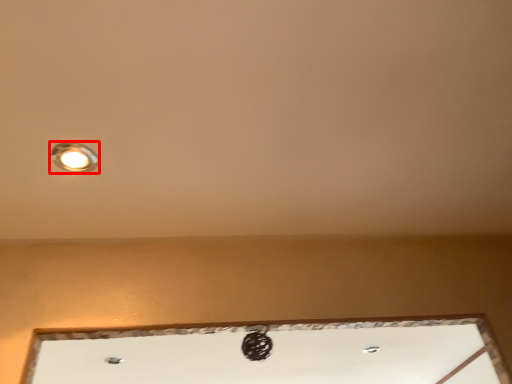
Question: From the image's perspective, where is lamp (annotated by the red box) located in relation to window in the image?

Choices:
 (A) above
 (B) below

Answer: (A)